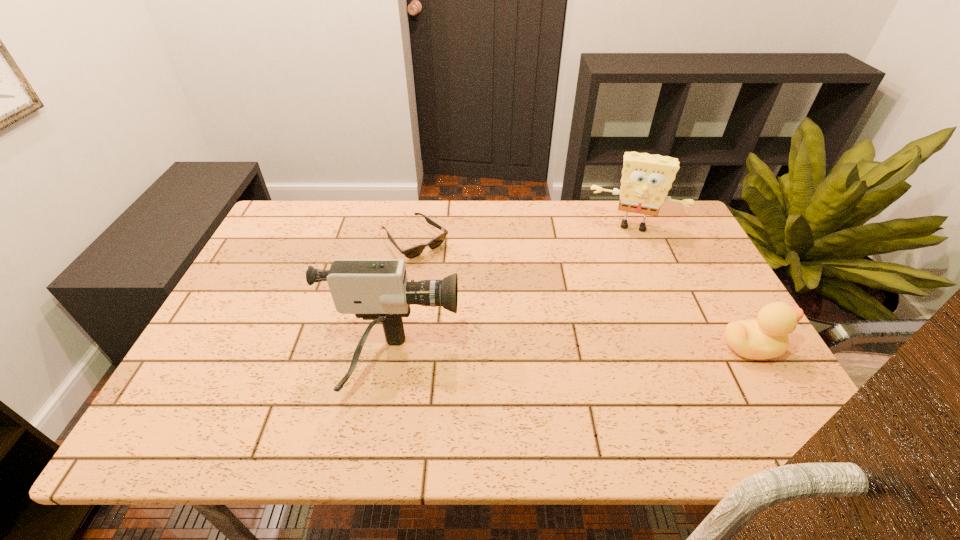
Locate an element on the screen. camcorder is located at coordinates (378, 290).

Where is `the second shortest object`? The height and width of the screenshot is (540, 960). the second shortest object is located at coordinates (766, 337).

At what (x,y) coordinates should I click in order to perform the action: click on sponge. Please return your answer as a coordinate pair (x, y). This screenshot has height=540, width=960. Looking at the image, I should click on (646, 179).

Where is `the shortest object`? The image size is (960, 540). the shortest object is located at coordinates coord(414,251).

Find the location of a particular element. The image size is (960, 540). free spot located on the recording direction of the camcorder is located at coordinates (554, 364).

You are a GUI agent. You are given a task and a screenshot of the screen. Output one action in this format:
    pyautogui.click(x=<x>, y=<y>)
    Task: Click on the free location located 0.290m on the face of the sponge
    The height and width of the screenshot is (540, 960).
    Given the screenshot: What is the action you would take?
    pyautogui.click(x=618, y=300)

At what (x,y) coordinates should I click in order to perform the action: click on vacant space positioned on the face of the sponge. Please return your answer as a coordinate pair (x, y). Looking at the image, I should click on (615, 325).

Locate an element on the screen. Image resolution: width=960 pixels, height=540 pixels. blank space located on the face of the sponge is located at coordinates (619, 285).

You are a GUI agent. You are given a task and a screenshot of the screen. Output one action in this format:
    pyautogui.click(x=<x>, y=<y>)
    Task: Click on the vacant space situated 0.060m on the front-facing side of the sunglasses
    
    Given the screenshot: What is the action you would take?
    pyautogui.click(x=445, y=270)

Image resolution: width=960 pixels, height=540 pixels. Identify the location of vacant space located on the front-facing side of the sunglasses. (495, 318).